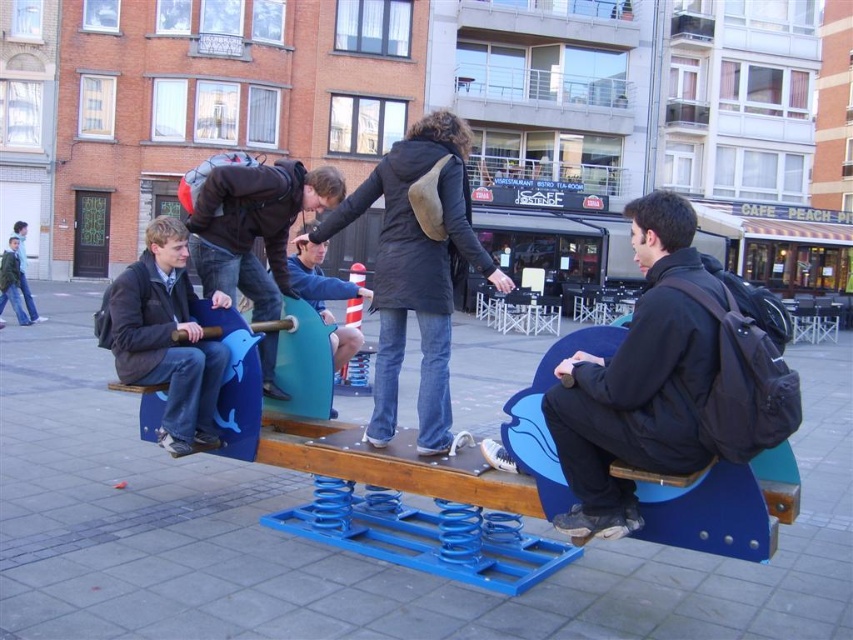
Question: Is blue painted wood park bench at center to the right of blue plastic bench at right from the viewer's perspective?

Choices:
 (A) no
 (B) yes

Answer: (A)

Question: Is blue plastic bench at right to the right of matte black jacket at left from the viewer's perspective?

Choices:
 (A) no
 (B) yes

Answer: (B)

Question: Which point is closer to the camera taking this photo?

Choices:
 (A) (218, 362)
 (B) (409, 518)

Answer: (A)

Question: Is matte black jacket at left further to camera compared to matte black jacket at center?

Choices:
 (A) yes
 (B) no

Answer: (B)

Question: Which object is closer to the camera taking this photo?

Choices:
 (A) black matte jacket at center
 (B) matte black jacket at center
 (C) blue painted wood park bench at center
 (D) blue plastic bench at right

Answer: (D)

Question: Among these objects, which one is nearest to the camera?

Choices:
 (A) matte black jacket at left
 (B) black matte jacket at center
 (C) blue painted wood park bench at center

Answer: (B)